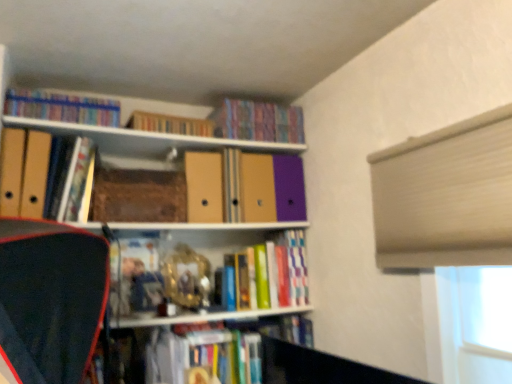
Question: Is hardcover book at center, which is counted as the seventh book, starting from the top, facing away from hardcover book at upper left, positioned as the fourth book in top-to-bottom order?

Choices:
 (A) yes
 (B) no

Answer: (B)

Question: Does hardcover book at center, which is counted as the seventh book, starting from the top, have a greater height compared to hardcover book at upper left, which is the 4th book in bottom-to-top order?

Choices:
 (A) yes
 (B) no

Answer: (A)

Question: From the image's perspective, would you say hardcover book at center, which is counted as the seventh book, starting from the top, is positioned over hardcover book at upper left, positioned as the fourth book in top-to-bottom order?

Choices:
 (A) no
 (B) yes

Answer: (A)

Question: From a real-world perspective, is hardcover book at center, which is counted as the seventh book, starting from the top, over hardcover book at upper left, which is the 4th book in bottom-to-top order?

Choices:
 (A) yes
 (B) no

Answer: (B)

Question: From the image's perspective, is hardcover book at center, positioned as the 1th book in bottom-to-top order, below hardcover book at upper left, which is the 4th book in bottom-to-top order?

Choices:
 (A) no
 (B) yes

Answer: (B)

Question: Does hardcover book at center, positioned as the 1th book in bottom-to-top order, lie in front of hardcover book at upper left, which is the 4th book in bottom-to-top order?

Choices:
 (A) no
 (B) yes

Answer: (A)

Question: Is hardcover book at upper left, which is the 4th book in bottom-to-top order, wider than hardcover book at upper center, the fifth book ordered from the bottom?

Choices:
 (A) yes
 (B) no

Answer: (A)

Question: Considering the relative positions of hardcover book at upper left, which is the 4th book in bottom-to-top order, and hardcover book at upper center, the fifth book ordered from the bottom, in the image provided, is hardcover book at upper left, which is the 4th book in bottom-to-top order, in front of hardcover book at upper center, the fifth book ordered from the bottom,?

Choices:
 (A) no
 (B) yes

Answer: (B)

Question: Would you consider hardcover book at upper left, positioned as the fourth book in top-to-bottom order, to be distant from hardcover book at upper center, the fifth book ordered from the bottom?

Choices:
 (A) yes
 (B) no

Answer: (B)

Question: Is hardcover book at upper left, positioned as the fourth book in top-to-bottom order, at the left side of hardcover book at upper center, the 3th book when ordered from top to bottom?

Choices:
 (A) yes
 (B) no

Answer: (A)

Question: Is hardcover book at upper left, which is the 4th book in bottom-to-top order, positioned beyond the bounds of hardcover book at upper center, the fifth book ordered from the bottom?

Choices:
 (A) yes
 (B) no

Answer: (A)

Question: Can you confirm if hardcover book at upper left, which is the 4th book in bottom-to-top order, is taller than hardcover book at upper center, the 3th book when ordered from top to bottom?

Choices:
 (A) yes
 (B) no

Answer: (A)

Question: Can you confirm if hardcover book at upper center, the 3th book when ordered from top to bottom, is shorter than brown matte paper at center, which is the 1th paperback book from back to front?

Choices:
 (A) yes
 (B) no

Answer: (A)